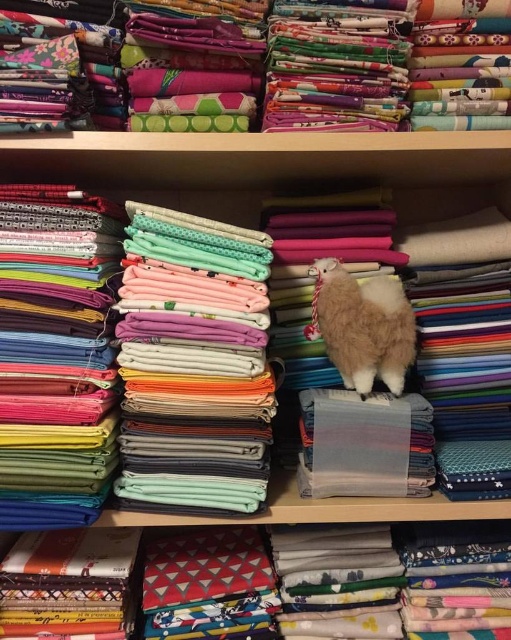
You are an interior designer planning to place a decorative item on the shelf. The shelf has a coordinate system where the bottom left corner is the origin. You want to place the item at the same position as the floral fabric at upper center. What are the coordinates where you should place the item?

The coordinates to place the item are at point (316, 65), which is where the floral fabric at upper center is located.

You are a customer looking to buy fabric and see the floral fabric at upper center and the fluffy white alpaca at center. Which object is taller?

The fluffy white alpaca at center is taller than the floral fabric at upper center.